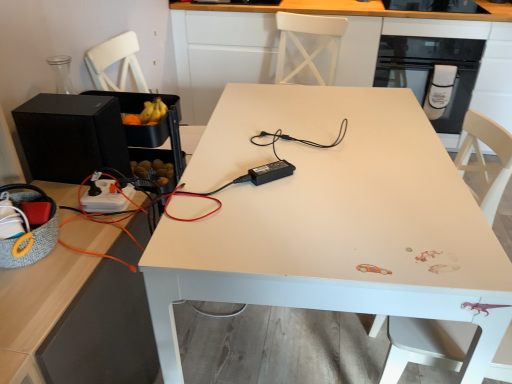
Question: Is black glass door at upper right located outside white wood swivel chair at lower right?

Choices:
 (A) yes
 (B) no

Answer: (A)

Question: Is black glass door at upper right facing away from white wood swivel chair at lower right?

Choices:
 (A) yes
 (B) no

Answer: (B)

Question: Does black glass door at upper right have a greater width compared to white wood swivel chair at lower right?

Choices:
 (A) no
 (B) yes

Answer: (B)

Question: Could you tell me if black glass door at upper right is facing white wood swivel chair at lower right?

Choices:
 (A) no
 (B) yes

Answer: (B)

Question: From a real-world perspective, is black glass door at upper right over white wood swivel chair at lower right?

Choices:
 (A) yes
 (B) no

Answer: (A)

Question: Looking at their shapes, would you say black plastic power adapter at center, the 2th appliance viewed from the back, is wider or thinner than white matte table at center?

Choices:
 (A) thin
 (B) wide

Answer: (A)

Question: Does point (266, 173) appear closer or farther from the camera than point (397, 274)?

Choices:
 (A) closer
 (B) farther

Answer: (B)

Question: Looking at the image, does black plastic power adapter at center, positioned as the first appliance in front-to-back order, seem bigger or smaller compared to white matte table at center?

Choices:
 (A) small
 (B) big

Answer: (A)

Question: Is black plastic power adapter at center, the 2th appliance from the left, spatially inside white matte table at center, or outside of it?

Choices:
 (A) outside
 (B) inside

Answer: (B)

Question: Is white matte table at center spatially inside black glass door at upper right, or outside of it?

Choices:
 (A) outside
 (B) inside

Answer: (A)

Question: Is white matte table at center taller or shorter than black glass door at upper right?

Choices:
 (A) short
 (B) tall

Answer: (B)

Question: From the image's perspective, relative to black glass door at upper right, is white matte table at center above or below?

Choices:
 (A) below
 (B) above

Answer: (B)

Question: Looking at the image, does white matte table at center seem bigger or smaller compared to black glass door at upper right?

Choices:
 (A) big
 (B) small

Answer: (A)

Question: From their relative heights in the image, would you say black matte speaker at left, placed as the second appliance when sorted from right to left, is taller or shorter than white matte table at center?

Choices:
 (A) tall
 (B) short

Answer: (B)

Question: Considering the positions of point click(105, 147) and point click(335, 168), is point click(105, 147) closer or farther from the camera than point click(335, 168)?

Choices:
 (A) closer
 (B) farther

Answer: (B)